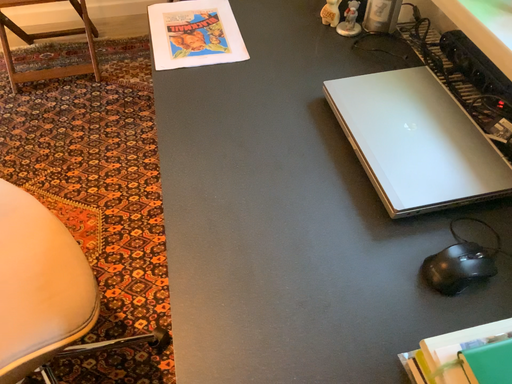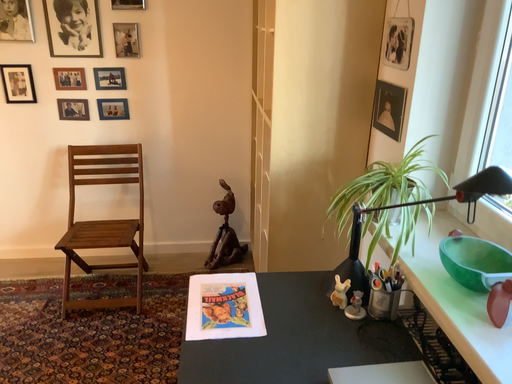
Question: How did the camera likely rotate when shooting the video?

Choices:
 (A) rotated upward
 (B) rotated downward

Answer: (A)